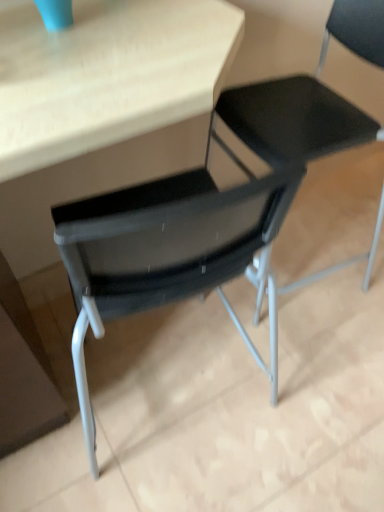
Question: From the image's perspective, is matte wood table at center beneath black mesh chair at center, placed as the first chair when sorted from right to left?

Choices:
 (A) no
 (B) yes

Answer: (A)

Question: Is matte wood table at center taller than black mesh chair at center, acting as the 2th chair starting from the left?

Choices:
 (A) no
 (B) yes

Answer: (B)

Question: Is matte wood table at center positioned beyond the bounds of black mesh chair at center, acting as the 2th chair starting from the left?

Choices:
 (A) no
 (B) yes

Answer: (B)

Question: Is matte wood table at center far away from black mesh chair at center, placed as the first chair when sorted from right to left?

Choices:
 (A) no
 (B) yes

Answer: (A)

Question: From the image's perspective, is matte wood table at center on black mesh chair at center, acting as the 2th chair starting from the left?

Choices:
 (A) no
 (B) yes

Answer: (B)

Question: Is point (162, 73) closer or farther from the camera than point (369, 20)?

Choices:
 (A) farther
 (B) closer

Answer: (B)

Question: Is matte wood table at center situated inside black mesh chair at center, the second chair in the right-to-left sequence, or outside?

Choices:
 (A) outside
 (B) inside

Answer: (A)

Question: Looking at the image, does matte wood table at center seem bigger or smaller compared to black mesh chair at center, the second chair in the right-to-left sequence?

Choices:
 (A) small
 (B) big

Answer: (B)

Question: Visually, is matte wood table at center positioned to the left or to the right of black mesh chair at center, the first chair in the left-to-right sequence?

Choices:
 (A) left
 (B) right

Answer: (A)

Question: Is black mesh chair at center, placed as the first chair when sorted from right to left, to the left or to the right of black mesh chair at center, the second chair in the right-to-left sequence, in the image?

Choices:
 (A) right
 (B) left

Answer: (A)

Question: Considering their positions, is black mesh chair at center, acting as the 2th chair starting from the left, located in front of or behind black mesh chair at center, the second chair in the right-to-left sequence?

Choices:
 (A) behind
 (B) front

Answer: (A)

Question: From the image's perspective, relative to black mesh chair at center, the second chair in the right-to-left sequence, is black mesh chair at center, placed as the first chair when sorted from right to left, above or below?

Choices:
 (A) above
 (B) below

Answer: (B)

Question: Considering the positions of black mesh chair at center, acting as the 2th chair starting from the left, and black mesh chair at center, the second chair in the right-to-left sequence, in the image, is black mesh chair at center, acting as the 2th chair starting from the left, taller or shorter than black mesh chair at center, the second chair in the right-to-left sequence,?

Choices:
 (A) short
 (B) tall

Answer: (A)

Question: In the image, is black mesh chair at center, placed as the first chair when sorted from right to left, on the left side or the right side of matte wood table at center?

Choices:
 (A) right
 (B) left

Answer: (A)

Question: From the image's perspective, is black mesh chair at center, placed as the first chair when sorted from right to left, positioned above or below matte wood table at center?

Choices:
 (A) below
 (B) above

Answer: (A)